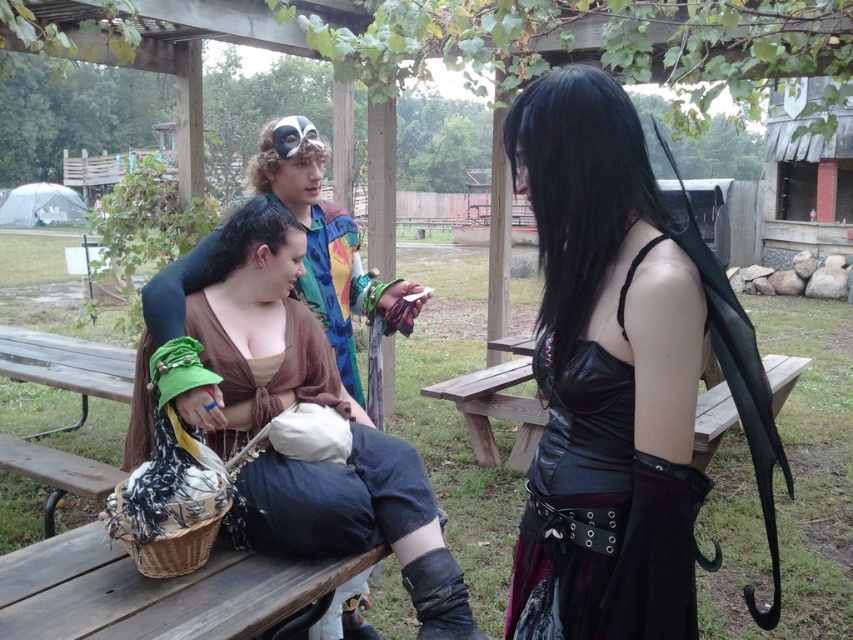
Is point (656, 576) farther from camera compared to point (189, 384)?

No.

I want to click on black leather top at center, so click(x=619, y=378).

Which is more to the right, brown fabric top at center or wooden bench at center?

Positioned to the right is wooden bench at center.

Is brown fabric top at center above wooden bench at center?

Yes, brown fabric top at center is above wooden bench at center.

At what (x,y) coordinates should I click in order to perform the action: click on brown fabric top at center. Please return your answer as a coordinate pair (x, y). Looking at the image, I should click on (283, 406).

Find the location of a particular element. This screenshot has height=640, width=853. brown fabric top at center is located at coordinates (283, 406).

Is brown fabric top at center wider than green fabric purse at center?

Indeed, brown fabric top at center has a greater width compared to green fabric purse at center.

Is brown fabric top at center to the right of green fabric purse at center from the viewer's perspective?

Indeed, brown fabric top at center is positioned on the right side of green fabric purse at center.

Is point (276, 362) positioned behind point (187, 348)?

Yes.

You are a GUI agent. You are given a task and a screenshot of the screen. Output one action in this format:
    pyautogui.click(x=<x>, y=<y>)
    Task: Click on the brown fabric top at center
    The width and height of the screenshot is (853, 640).
    Given the screenshot: What is the action you would take?
    pyautogui.click(x=283, y=406)